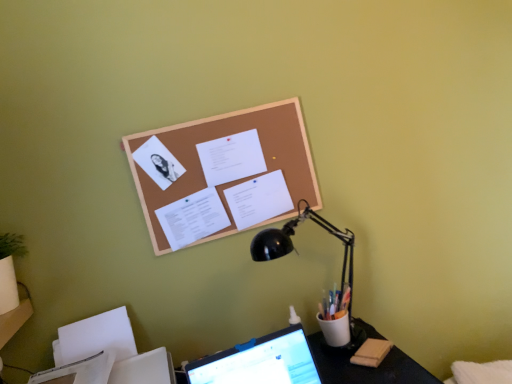
What is the approximate width of black plastic desk at lower center?

It is 32.44 centimeters.

The image size is (512, 384). What do you see at coordinates (259, 199) in the screenshot? I see `white paper at center, positioned as the second document in bottom-to-top order` at bounding box center [259, 199].

Describe the element at coordinates (231, 157) in the screenshot. I see `white paper at center, arranged as the 1th document when viewed from the top` at that location.

This screenshot has height=384, width=512. Find the location of `black metal lamp at upper right`. black metal lamp at upper right is located at coordinates (295, 250).

Is corkboard at upper center at the back of white paper at center, marked as the 2th document in a top-to-bottom arrangement?

Yes.

Which is closer, (270, 188) or (164, 131)?

Point (270, 188) is positioned farther from the camera compared to point (164, 131).

Considering the sizes of white paper at center, positioned as the second document in bottom-to-top order, and corkboard at upper center in the image, is white paper at center, positioned as the second document in bottom-to-top order, bigger or smaller than corkboard at upper center?

In the image, white paper at center, positioned as the second document in bottom-to-top order, appears to be smaller than corkboard at upper center.

Does white paper at center, positioned as the second document in bottom-to-top order, have a greater height compared to corkboard at upper center?

Incorrect, the height of white paper at center, positioned as the second document in bottom-to-top order, is not larger of that of corkboard at upper center.

Looking at this image, from a real-world perspective, relative to corkboard at upper center, is black metal lamp at upper right vertically above or below?

black metal lamp at upper right is situated lower than corkboard at upper center in the real world.

Considering the positions of objects black metal lamp at upper right and corkboard at upper center in the image provided, who is more to the left, black metal lamp at upper right or corkboard at upper center?

From the viewer's perspective, corkboard at upper center appears more on the left side.

Considering the relative sizes of black metal lamp at upper right and corkboard at upper center in the image provided, is black metal lamp at upper right wider than corkboard at upper center?

Yes, black metal lamp at upper right is wider than corkboard at upper center.

Is white paper at center, positioned as the second document in bottom-to-top order, not within black metal lamp at upper right?

Yes, white paper at center, positioned as the second document in bottom-to-top order, is located beyond the bounds of black metal lamp at upper right.

From the image's perspective, relative to black metal lamp at upper right, is white paper at center, positioned as the second document in bottom-to-top order, above or below?

From the image's perspective, white paper at center, positioned as the second document in bottom-to-top order, appears above black metal lamp at upper right.

Which of these two, white paper at center, marked as the 2th document in a top-to-bottom arrangement, or black metal lamp at upper right, is bigger?

With larger size is black metal lamp at upper right.

Which object is positioned more to the right, white paper at center, arranged as the 1th document when viewed from the top, or black metal lamp at upper right?

black metal lamp at upper right.

Consider the image. Does white paper at center, which is the 3th document in bottom-to-top order, have a greater width compared to black metal lamp at upper right?

Incorrect, the width of white paper at center, which is the 3th document in bottom-to-top order, does not surpass that of black metal lamp at upper right.

At what (x,y) coordinates should I click in order to perform the action: click on lamp below the white paper at center, arranged as the 1th document when viewed from the top (from a real-world perspective). Please return your answer as a coordinate pair (x, y). This screenshot has height=384, width=512. Looking at the image, I should click on (295, 250).

Does white paper at center, arranged as the 1th document when viewed from the top, contain black metal lamp at upper right?

No, black metal lamp at upper right is not surrounded by white paper at center, arranged as the 1th document when viewed from the top.

Can you confirm if white paper at center, which ranks as the third document in top-to-bottom order, is positioned to the right of white paper at center, arranged as the 1th document when viewed from the top?

No, white paper at center, which ranks as the third document in top-to-bottom order, is not to the right of white paper at center, arranged as the 1th document when viewed from the top.

Does white paper at center, which ranks as the third document in top-to-bottom order, touch white paper at center, arranged as the 1th document when viewed from the top?

No.

From the picture: Which of these two, white paper at center, which ranks as the third document in top-to-bottom order, or white paper at center, arranged as the 1th document when viewed from the top, is bigger?

Bigger between the two is white paper at center, which ranks as the third document in top-to-bottom order.

In terms of height, does white paper at center, which ranks as the third document in top-to-bottom order, look taller or shorter compared to white paper at center, which is the 3th document in bottom-to-top order?

Considering their sizes, white paper at center, which ranks as the third document in top-to-bottom order, has less height than white paper at center, which is the 3th document in bottom-to-top order.

Is the surface of black metal lamp at upper right in direct contact with white paper at center, marked as the 2th document in a top-to-bottom arrangement?

No, black metal lamp at upper right is not beside white paper at center, marked as the 2th document in a top-to-bottom arrangement.

From the picture: Does black metal lamp at upper right have a smaller size compared to white paper at center, positioned as the second document in bottom-to-top order?

Incorrect, black metal lamp at upper right is not smaller in size than white paper at center, positioned as the second document in bottom-to-top order.

How different are the orientations of black metal lamp at upper right and white paper at center, positioned as the second document in bottom-to-top order, in degrees?

The facing directions of black metal lamp at upper right and white paper at center, positioned as the second document in bottom-to-top order, are 0.8 degrees apart.

Is black metal lamp at upper right spatially inside white paper at center, positioned as the second document in bottom-to-top order, or outside of it?

black metal lamp at upper right is not enclosed by white paper at center, positioned as the second document in bottom-to-top order.

Which is in front, point (325, 375) or point (272, 200)?

Positioned in front is point (325, 375).

In the scene shown: Is white paper at center, marked as the 2th document in a top-to-bottom arrangement, at the back of black plastic desk at lower center?

No, black plastic desk at lower center is not facing the opposite direction of white paper at center, marked as the 2th document in a top-to-bottom arrangement.

Does black plastic desk at lower center appear on the right side of white paper at center, positioned as the second document in bottom-to-top order?

Yes, black plastic desk at lower center is to the right of white paper at center, positioned as the second document in bottom-to-top order.

Consider the image. Is black plastic desk at lower center positioned beyond the bounds of white paper at center, marked as the 2th document in a top-to-bottom arrangement?

black plastic desk at lower center is positioned outside white paper at center, marked as the 2th document in a top-to-bottom arrangement.

From the corkboard at upper center, count 3rd documents backward and point to it. Please provide its 2D coordinates.

[(259, 199)]

Image resolution: width=512 pixels, height=384 pixels. I want to click on lamp on the right of corkboard at upper center, so click(x=295, y=250).

Which object lies nearer to the anchor point black metal lamp at upper right, white paper at center, which ranks as the third document in top-to-bottom order, or white paper at center, positioned as the second document in bottom-to-top order?

white paper at center, positioned as the second document in bottom-to-top order.

When comparing their distances from black plastic desk at lower center, does white paper at center, which ranks as the third document in top-to-bottom order, or corkboard at upper center seem further?

corkboard at upper center is further to black plastic desk at lower center.

Which object lies nearer to the anchor point black plastic desk at lower center, white paper at center, arranged as the 1th document when viewed from the top, or white paper at center, positioned as the second document in bottom-to-top order?

white paper at center, positioned as the second document in bottom-to-top order.

Looking at the image, which one is located further to white paper at center, arranged as the 1th document when viewed from the top, black plastic desk at lower center or white paper at center, positioned as the second document in bottom-to-top order?

black plastic desk at lower center is further to white paper at center, arranged as the 1th document when viewed from the top.

Looking at the image, which one is located further to white paper at center, which is the 3th document in bottom-to-top order, corkboard at upper center or white paper at center, marked as the 2th document in a top-to-bottom arrangement?

white paper at center, marked as the 2th document in a top-to-bottom arrangement, is further to white paper at center, which is the 3th document in bottom-to-top order.

Looking at the image, which one is located further to white paper at center, which is the 3th document in bottom-to-top order, white paper at center, positioned as the second document in bottom-to-top order, or black plastic desk at lower center?

The object further to white paper at center, which is the 3th document in bottom-to-top order, is black plastic desk at lower center.

Considering their positions, is white paper at center, marked as the 2th document in a top-to-bottom arrangement, positioned closer to black metal lamp at upper right than corkboard at upper center?

Based on the image, white paper at center, marked as the 2th document in a top-to-bottom arrangement, appears to be nearer to black metal lamp at upper right.

From the picture: From the image, which object appears to be nearer to white paper at center, the 1th document when ordered from bottom to top, white paper at center, which is the 3th document in bottom-to-top order, or black plastic desk at lower center?

white paper at center, which is the 3th document in bottom-to-top order.

You are a GUI agent. You are given a task and a screenshot of the screen. Output one action in this format:
    pyautogui.click(x=<x>, y=<y>)
    Task: Click on the lamp located between black plastic desk at lower center and white paper at center, which ranks as the third document in top-to-bottom order, in the depth direction
    This screenshot has width=512, height=384.
    Given the screenshot: What is the action you would take?
    click(295, 250)

The width and height of the screenshot is (512, 384). What are the coordinates of `bulletin board between white paper at center, which is the 3th document in bottom-to-top order, and black metal lamp at upper right, in the vertical direction` in the screenshot? It's located at (218, 137).

In order to click on bulletin board between black plastic desk at lower center and white paper at center, which is the 3th document in bottom-to-top order, along the z-axis in this screenshot , I will do `click(218, 137)`.

Where is `lamp positioned between black plastic desk at lower center and white paper at center, marked as the 2th document in a top-to-bottom arrangement, from near to far`? The height and width of the screenshot is (384, 512). lamp positioned between black plastic desk at lower center and white paper at center, marked as the 2th document in a top-to-bottom arrangement, from near to far is located at coordinates (295, 250).